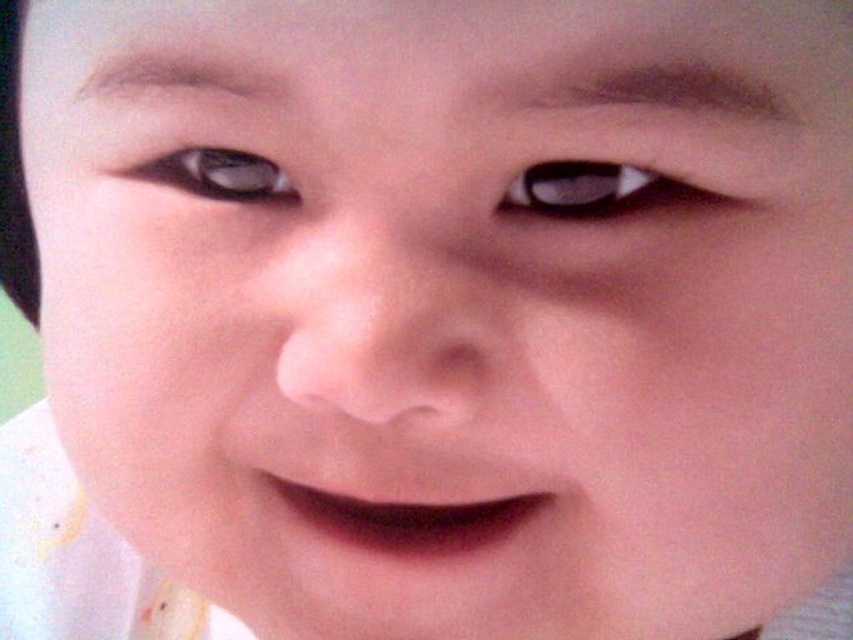
Question: Which object appears farthest from the camera in this image?

Choices:
 (A) matte brown eye at upper left
 (B) matte black eye at upper center

Answer: (A)

Question: Can you confirm if matte black eye at upper center is smaller than matte brown eye at upper left?

Choices:
 (A) yes
 (B) no

Answer: (B)

Question: Is matte black eye at upper center further to the viewer compared to matte brown eye at upper left?

Choices:
 (A) no
 (B) yes

Answer: (A)

Question: In this image, where is matte black eye at upper center located relative to matte brown eye at upper left?

Choices:
 (A) left
 (B) right

Answer: (B)

Question: Which point appears closest to the camera in this image?

Choices:
 (A) 241,164
 (B) 558,180

Answer: (B)